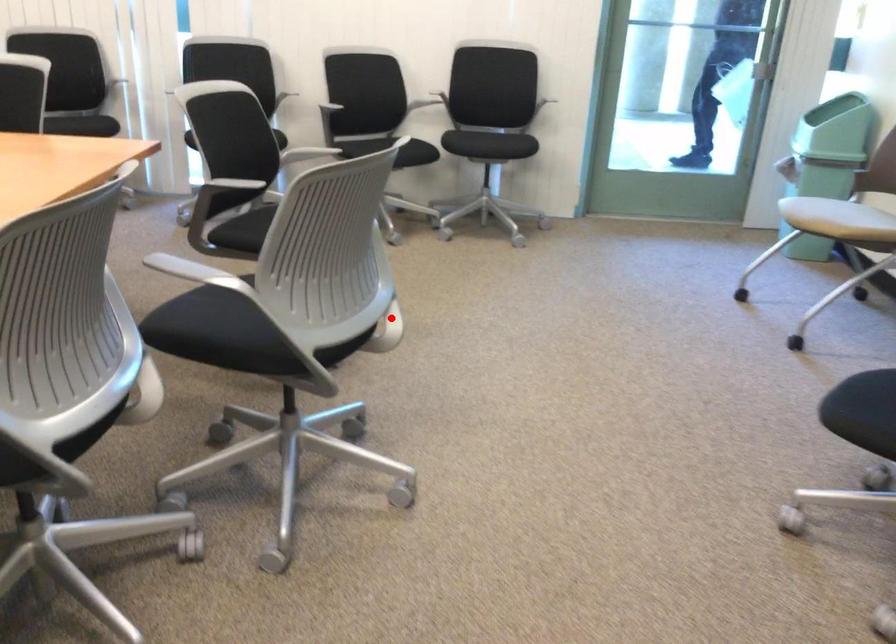
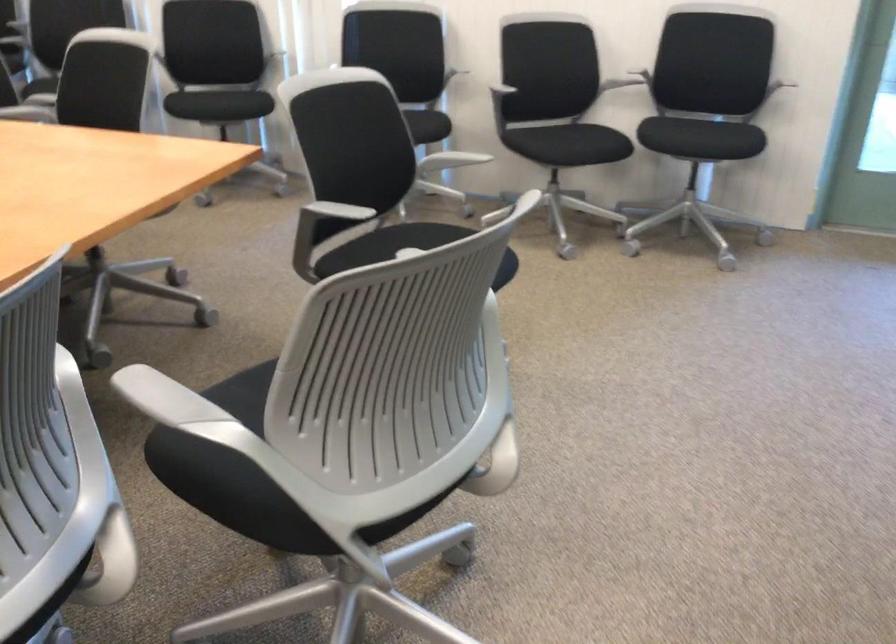
Question: I am providing you with two images of the same scene from different viewpoints. Given a red point in image1, look at the same physical point in image2. Is it:

Choices:
 (A) Closer to the viewpoint
 (B) Farther from the viewpoint

Answer: (A)